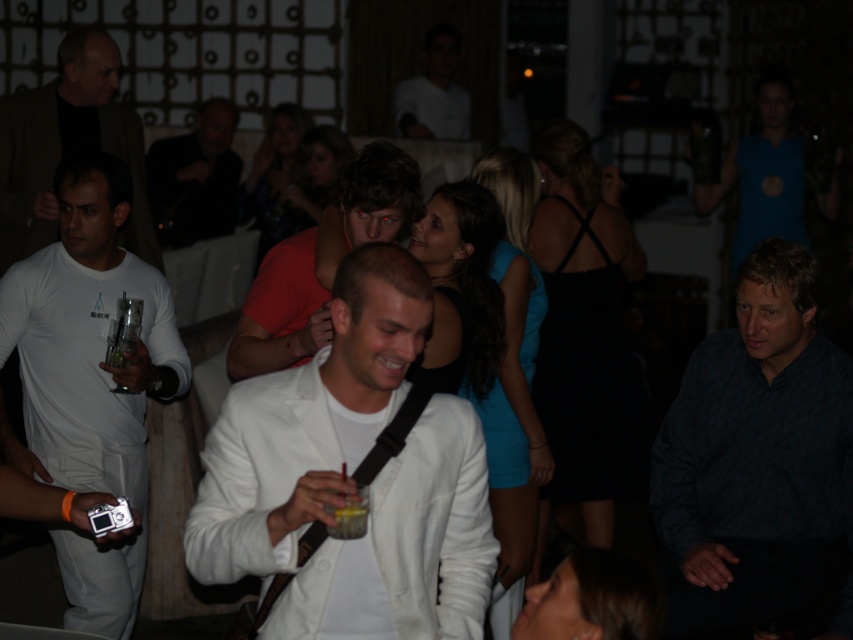
You are at a party and want to take a photo of the matte red shirt at center and the translucent glass drink at center. Which one is on the left side?

The matte red shirt at center is positioned on the left side of the translucent glass drink at center.

You are at a party and want to take a photo of the matte red shirt at center and the smooth white shirt at upper center. Which one would appear larger in your photo?

The matte red shirt at center would appear larger in the photo because it is closer to the viewer than the smooth white shirt at upper center.

You are a photographer at the event and need to take a clear photo of the matte red shirt at center and the translucent glass drink at center. Which object should you focus on first to ensure both are in focus?

The matte red shirt at center is closer to you than the translucent glass drink at center, so focus on the matte red shirt at center first to ensure both are in focus.